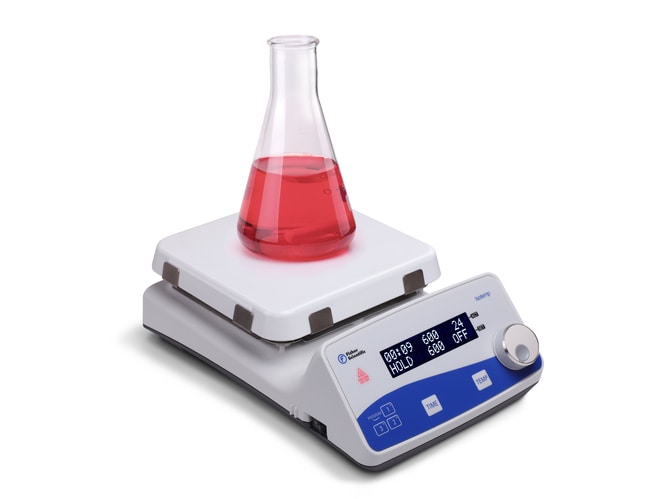
Locate an element on the screen. white button that says "temp" in blue is located at coordinates (486, 378).